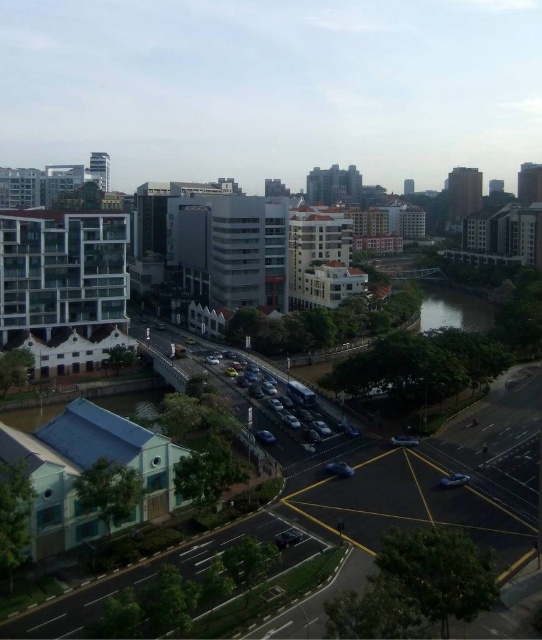
Question: Estimate the real-world distances between objects in this image. Which object is closer to the shiny black car at center?

Choices:
 (A) shiny silver sedan at center
 (B) shiny blue sedan at lower right

Answer: (B)

Question: Among these points, which one is farthest from the camera?

Choices:
 (A) (351, 468)
 (B) (293, 536)
 (C) (273, 436)
 (D) (395, 436)

Answer: (D)

Question: Among these objects, which one is farthest from the camera?

Choices:
 (A) shiny black car at center
 (B) metallic blue sedan at center

Answer: (B)

Question: Does shiny blue sedan at center have a larger size compared to shiny silver sedan at center?

Choices:
 (A) no
 (B) yes

Answer: (B)

Question: Does shiny blue sedan at center appear under shiny silver sedan at center?

Choices:
 (A) no
 (B) yes

Answer: (B)

Question: Can you confirm if shiny blue sedan at lower right is positioned above shiny blue sedan at center?

Choices:
 (A) no
 (B) yes

Answer: (A)